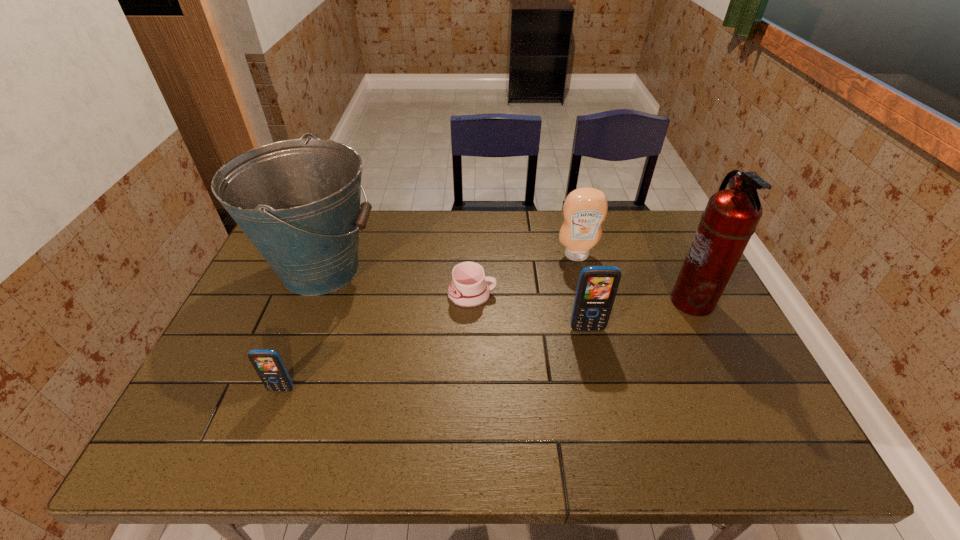
Find the location of a particular element. This screenshot has width=960, height=540. free space for an extra cellular_telephone to achieve even spacing is located at coordinates (444, 357).